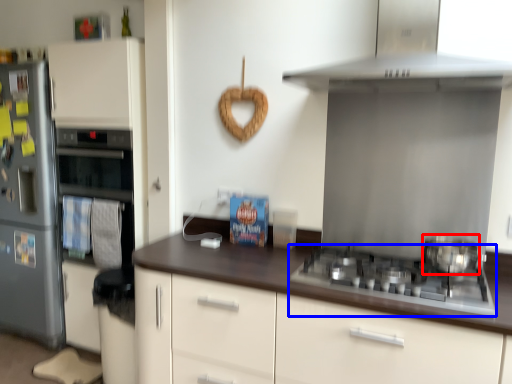
Question: Which point is further to the camera, kitchen appliance (highlighted by a red box) or gas stove (highlighted by a blue box)?

Choices:
 (A) kitchen appliance
 (B) gas stove

Answer: (A)